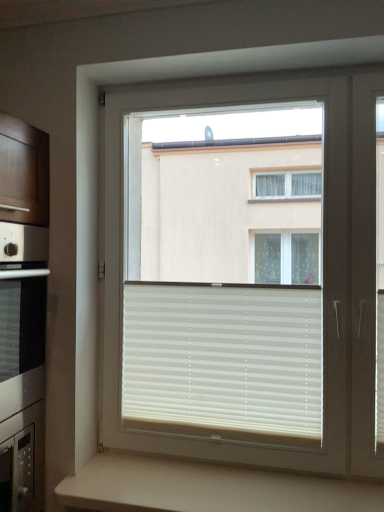
The height and width of the screenshot is (512, 384). Describe the element at coordinates (206, 488) in the screenshot. I see `beige matte counter at lower center` at that location.

The height and width of the screenshot is (512, 384). What do you see at coordinates (225, 271) in the screenshot?
I see `white plastic window at center` at bounding box center [225, 271].

This screenshot has width=384, height=512. I want to click on white plastic window at center, so click(x=225, y=271).

At what (x,y) coordinates should I click in order to perform the action: click on beige matte counter at lower center. Please return your answer as a coordinate pair (x, y). The image size is (384, 512). Looking at the image, I should click on (206, 488).

From the image's perspective, which is above, beige matte counter at lower center or white plastic window at center?

white plastic window at center, from the image's perspective.

Based on their positions, is beige matte counter at lower center located to the left or right of white plastic window at center?

From the image, it's evident that beige matte counter at lower center is to the left of white plastic window at center.

From a real-world perspective, which object rests below the other?

From a 3D spatial view, beige matte counter at lower center is below.

Is the surface of beige matte counter at lower center in direct contact with white plastic window at center?

No, beige matte counter at lower center is not in contact with white plastic window at center.

From the image's perspective, is white plastic window at center located beneath beige matte counter at lower center?

No, from the image's perspective, white plastic window at center is not beneath beige matte counter at lower center.

Would you say white plastic window at center is a long distance from beige matte counter at lower center?

Absolutely, white plastic window at center is distant from beige matte counter at lower center.

Is white plastic window at center positioned behind beige matte counter at lower center?

Yes, it is.

Which object is positioned more to the right, white plastic window at center or beige matte counter at lower center?

From the viewer's perspective, white plastic window at center appears more on the right side.

Does beige matte counter at lower center have a greater height compared to white matte blinds at center?

In fact, beige matte counter at lower center may be shorter than white matte blinds at center.

Is beige matte counter at lower center turned away from white matte blinds at center?

No.

Considering the relative sizes of beige matte counter at lower center and white matte blinds at center in the image provided, is beige matte counter at lower center thinner than white matte blinds at center?

No.

From the image's perspective, is beige matte counter at lower center on top of white matte blinds at center?

Incorrect, from the image's perspective, beige matte counter at lower center is lower than white matte blinds at center.

Does point (184, 314) appear closer or farther from the camera than point (258, 280)?

Point (184, 314).

From a real-world perspective, is white matte blinds at center located beneath white plastic window at center?

Correct, in the physical world, white matte blinds at center is lower than white plastic window at center.

Locate an element on the screen. window blind behind the white plastic window at center is located at coordinates (224, 357).

Are white matte blinds at center and white plastic window at center located far from each other?

white matte blinds at center is far away from white plastic window at center.

Is white plastic window at center spatially inside white matte blinds at center, or outside of it?

white plastic window at center is not enclosed by white matte blinds at center.

Based on the photo, would you say white plastic window at center is to the left or to the right of white matte blinds at center in the picture?

From the image, it's evident that white plastic window at center is to the right of white matte blinds at center.

Is white plastic window at center wider or thinner than white matte blinds at center?

white plastic window at center is wider than white matte blinds at center.

Relative to white matte blinds at center, is white plastic window at center in front or behind?

Visually, white plastic window at center is located in front of white matte blinds at center.

Considering the relative positions of white matte blinds at center and beige matte counter at lower center in the image provided, is white matte blinds at center to the right of beige matte counter at lower center from the viewer's perspective?

No, white matte blinds at center is not to the right of beige matte counter at lower center.

Is the position of white matte blinds at center more distant than that of beige matte counter at lower center?

That is True.

From the image's perspective, between white matte blinds at center and beige matte counter at lower center, which one is located above?

white matte blinds at center.

This screenshot has height=512, width=384. What are the coordinates of `counter that appears below the white plastic window at center (from a real-world perspective)` in the screenshot? It's located at (206, 488).

In order to click on bay window behind the beige matte counter at lower center in this screenshot , I will do `click(225, 271)`.

Considering their positions, is beige matte counter at lower center positioned closer to white matte blinds at center than white plastic window at center?

Among the two, beige matte counter at lower center is located nearer to white matte blinds at center.

Considering their positions, is white matte blinds at center positioned closer to beige matte counter at lower center than white plastic window at center?

white matte blinds at center is positioned closer to the anchor beige matte counter at lower center.

Considering their positions, is white plastic window at center positioned closer to beige matte counter at lower center than white matte blinds at center?

white matte blinds at center lies closer to beige matte counter at lower center than the other object.

From the image, which object appears to be farther from white matte blinds at center, white plastic window at center or beige matte counter at lower center?

white plastic window at center lies further to white matte blinds at center than the other object.

Estimate the real-world distances between objects in this image. Which object is closer to white plastic window at center, white matte blinds at center or beige matte counter at lower center?

Based on the image, white matte blinds at center appears to be nearer to white plastic window at center.

Based on their spatial positions, is beige matte counter at lower center or white matte blinds at center further from white plastic window at center?

Based on the image, beige matte counter at lower center appears to be further to white plastic window at center.

Image resolution: width=384 pixels, height=512 pixels. Find the location of `window blind between white plastic window at center and beige matte counter at lower center vertically`. window blind between white plastic window at center and beige matte counter at lower center vertically is located at coordinates (224, 357).